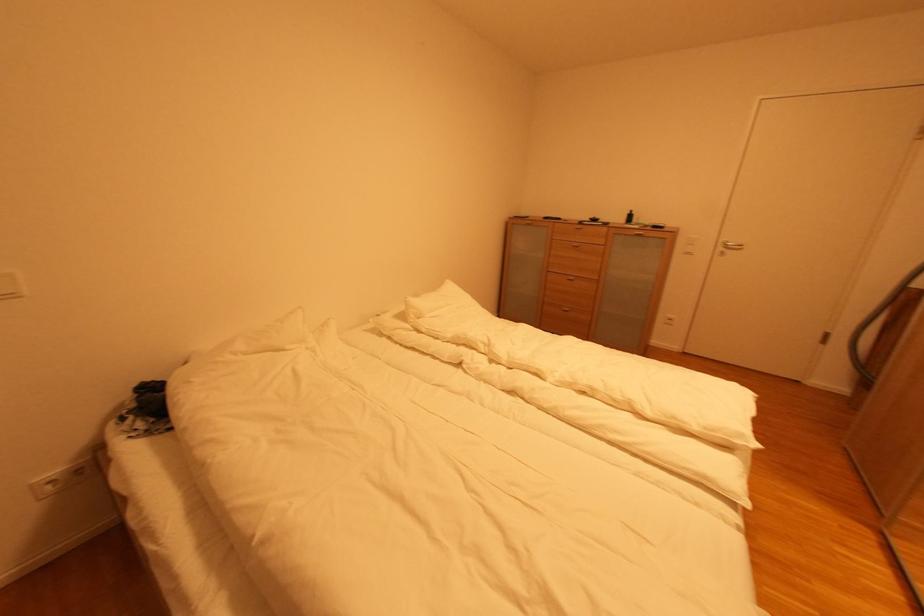
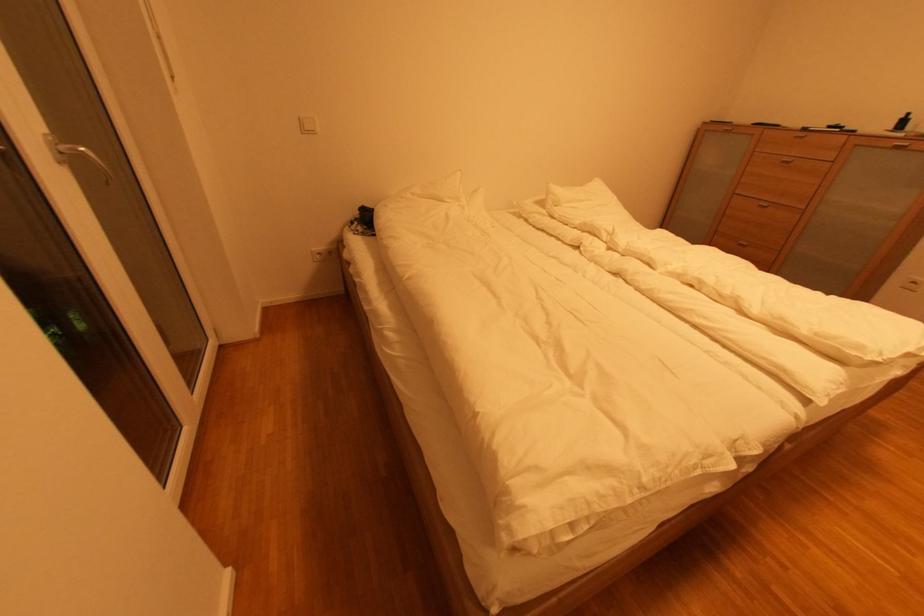
Question: The camera is either moving clockwise (left) or counter-clockwise (right) around the object. The first image is from the beginning of the video and the second image is from the end. Is the camera moving left or right when shooting the video?

Choices:
 (A) Left
 (B) Right

Answer: (B)